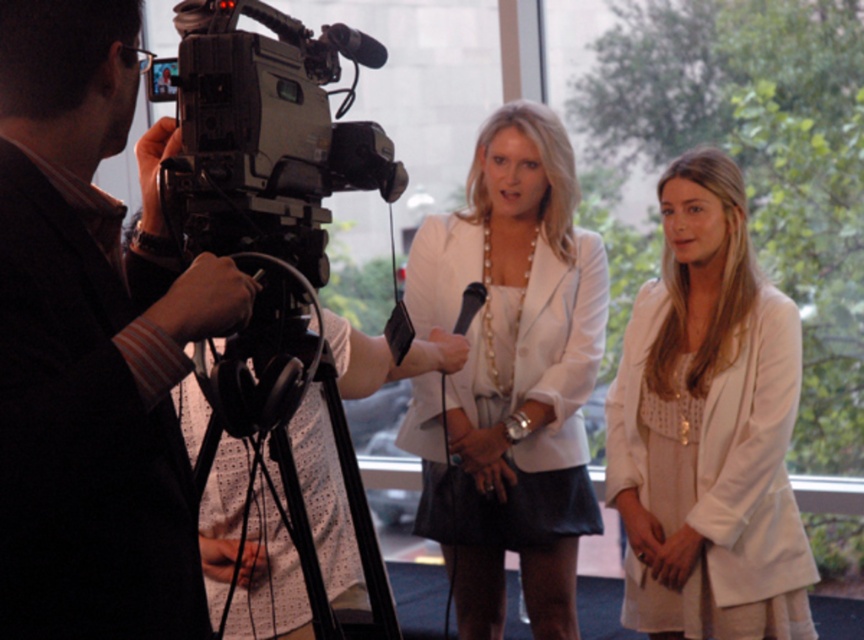
How far apart are black fabric camera at left and white textured blazer at center?

The distance of black fabric camera at left from white textured blazer at center is 5.86 feet.

Is black fabric camera at left to the right of white textured blazer at center from the viewer's perspective?

No, black fabric camera at left is not to the right of white textured blazer at center.

Identify the location of black fabric camera at left. (92, 342).

This screenshot has width=864, height=640. In order to click on black fabric camera at left in this screenshot , I will do `click(92, 342)`.

Does point (535, 362) lie in front of point (634, 520)?

No, (535, 362) is further to viewer.

Is the position of white pearl necklace at center less distant than that of white textured blazer at center?

No, it is not.

The image size is (864, 640). I want to click on white pearl necklace at center, so pyautogui.click(x=510, y=376).

Locate an element on the screen. white pearl necklace at center is located at coordinates (510, 376).

Which is more to the right, black fabric camera at left or white pearl necklace at center?

From the viewer's perspective, white pearl necklace at center appears more on the right side.

Does point (75, 93) lie behind point (417, 323)?

No.

You are a GUI agent. You are given a task and a screenshot of the screen. Output one action in this format:
    pyautogui.click(x=<x>, y=<y>)
    Task: Click on the black fabric camera at left
    This screenshot has width=864, height=640.
    Given the screenshot: What is the action you would take?
    pyautogui.click(x=92, y=342)

I want to click on black fabric camera at left, so click(92, 342).